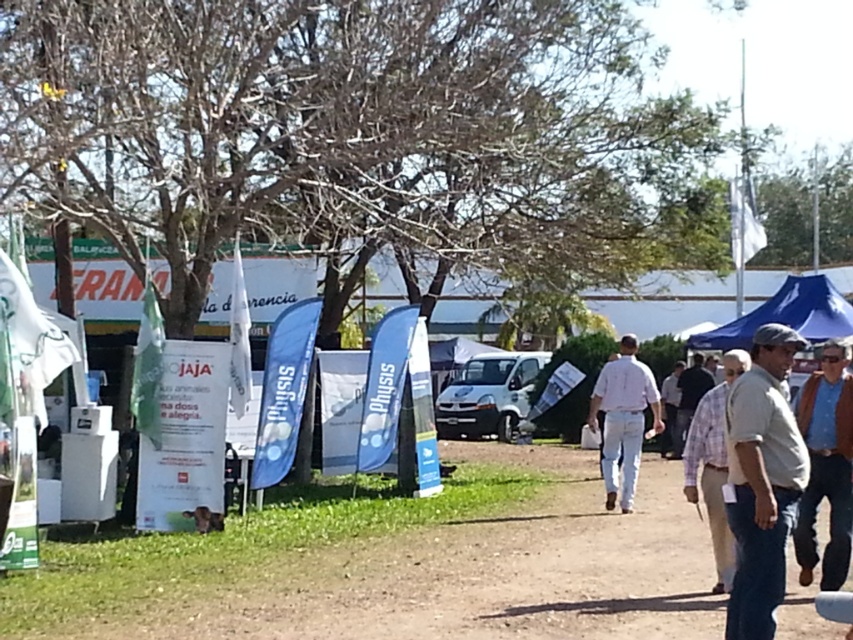
Measure the distance between brown leather jacket at lower right and light brown cotton shirt at center.

A distance of 27.45 inches exists between brown leather jacket at lower right and light brown cotton shirt at center.

Locate an element on the screen. The height and width of the screenshot is (640, 853). brown leather jacket at lower right is located at coordinates (827, 467).

What do you see at coordinates (827, 467) in the screenshot? I see `brown leather jacket at lower right` at bounding box center [827, 467].

This screenshot has height=640, width=853. Identify the location of brown leather jacket at lower right. (827, 467).

Is point (693, 440) farther from camera compared to point (666, 404)?

That is False.

Which of these two, light brown cotton shirt at center or light brown shirt at center, stands shorter?

With less height is light brown shirt at center.

This screenshot has width=853, height=640. Describe the element at coordinates (712, 465) in the screenshot. I see `light brown cotton shirt at center` at that location.

You are a GUI agent. You are given a task and a screenshot of the screen. Output one action in this format:
    pyautogui.click(x=<x>, y=<y>)
    Task: Click on the light brown cotton shirt at center
    
    Given the screenshot: What is the action you would take?
    pyautogui.click(x=712, y=465)

Is brown leather jacket at lower right smaller than white cotton shirt at center?

Incorrect, brown leather jacket at lower right is not smaller in size than white cotton shirt at center.

Which is in front, point (840, 531) or point (610, 440)?

Point (840, 531) is more forward.

Which is in front, point (845, 410) or point (642, 378)?

Point (845, 410)

Identify the location of brown leather jacket at lower right. (827, 467).